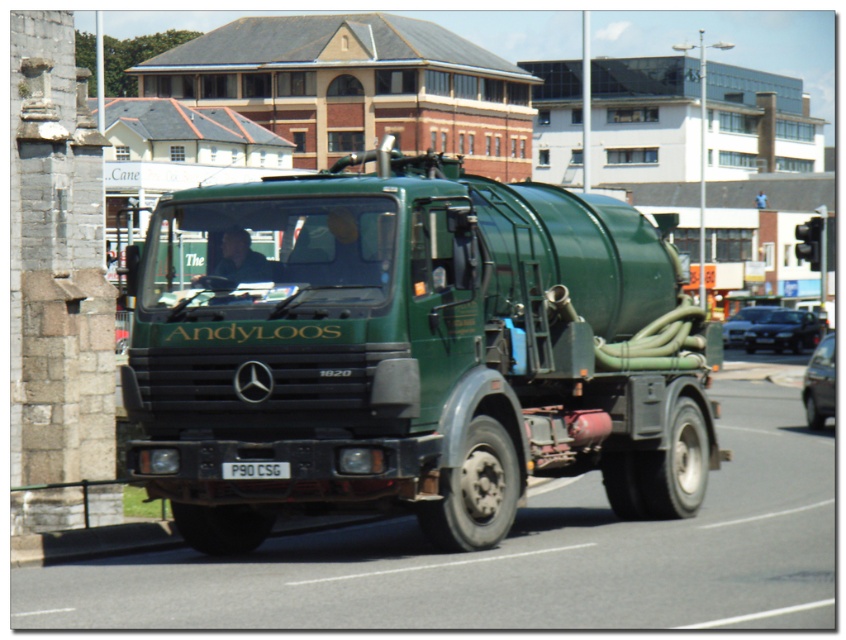
You are standing at the point marked by the coordinates point (410, 352) in the image. What object are you directly facing?

The point (410, 352) marks the green matte truck at center, so you are directly facing the green matte truck at center.

You are a photographer trying to capture the green matte truck at center and the white plastic license plate at center in a single shot. Since you want both objects to be clearly visible, will the size difference between them affect your ability to do so?

The green matte truck at center is larger in size than the white plastic license plate at center, so the size difference will not hinder capturing both in a single shot as the truck is bigger and the license plate smaller, allowing them to coexist within the frame.

You are standing on the road next to the green Mercedes truck labeled AndyLoos. There are two points marked on the road ahead of you at coordinates point (559, 236) and point (250, 461). Which point is closer to you?

Point (559, 236) is closer to you because it is further to the viewer than point (250, 461).